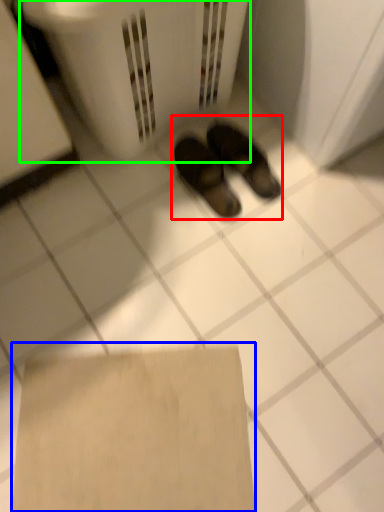
Question: Based on their relative distances, which object is farther from footwear (highlighted by a red box)? Choose from cardboard (highlighted by a blue box) and laundry basket (highlighted by a green box).

Choices:
 (A) cardboard
 (B) laundry basket

Answer: (A)